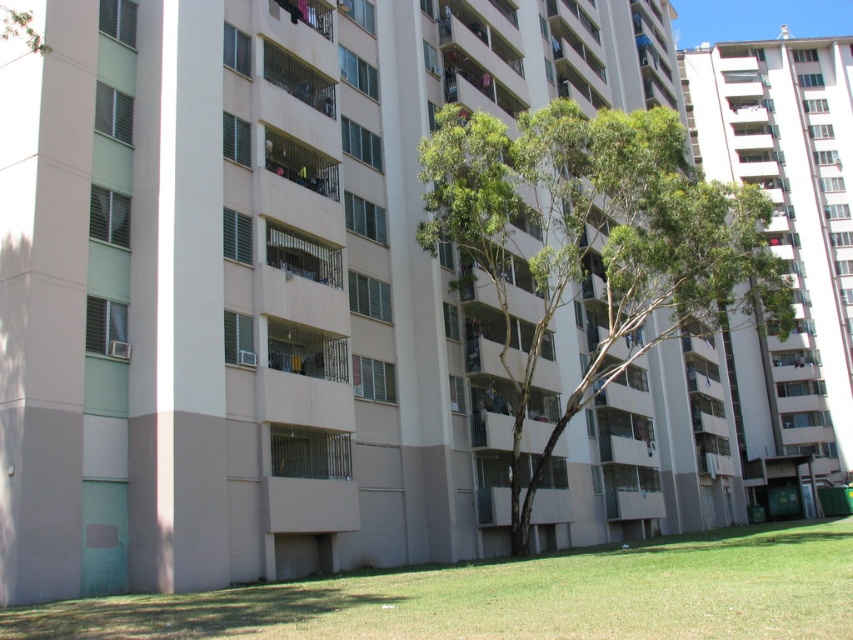
You are standing at the entrance of the residential building and want to find the green leafy tree at center. Based on the coordinates provided, in which direction should you look to locate it?

The green leafy tree at center is located at coordinates point (596, 241), which means it is positioned to the left and slightly forward from the center point of the image. You should look towards the left side of the building and slightly forward to locate it.

You are standing in front of the residential building and want to determine the relative positions of two points marked in the image. Which point is closer to you, point (549, 100) or point (730, 556)?

Point (549, 100) is further to the viewer than point (730, 556), so point (730, 556) is closer to you.

You are standing in front of the residential building and want to find a spot to place a picnic blanket. Based on the scene, where would be the best location to ensure the blanket stays on the green grass at lower center without being under the green leafy tree at center?

The best location would be on the green grass at lower center but away from the area beneath the green leafy tree at center, as the tree is above the grass and its branches might block sunlight or drop leaves onto the blanket.